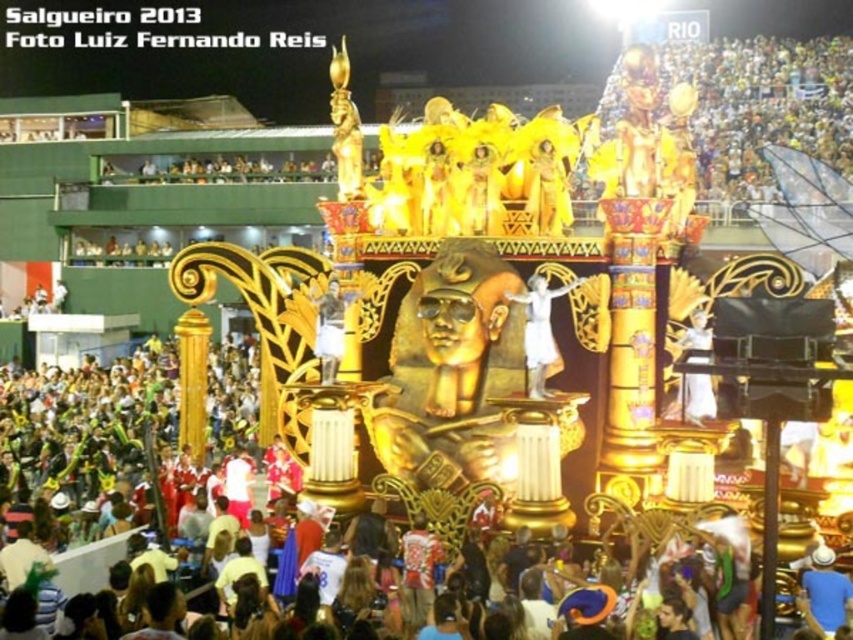
Can you confirm if white satin dress at center is positioned to the left of metallic gold statue at center?

In fact, white satin dress at center is to the right of metallic gold statue at center.

Can you confirm if white satin dress at center is taller than metallic gold statue at center?

No, white satin dress at center is not taller than metallic gold statue at center.

Looking at this image, who is more distant from viewer, (x=552, y=342) or (x=329, y=310)?

Positioned behind is point (x=329, y=310).

This screenshot has height=640, width=853. Identify the location of white satin dress at center. (540, 332).

Does white satin dress at center have a lesser height compared to golden statue at center?

Indeed, white satin dress at center has a lesser height compared to golden statue at center.

Who is more forward, (537, 298) or (703, 342)?

Point (537, 298)

Where is `white satin dress at center`? The width and height of the screenshot is (853, 640). white satin dress at center is located at coordinates (540, 332).

Can you confirm if golden statue at center is positioned to the left of metallic gold statue at center?

In fact, golden statue at center is to the right of metallic gold statue at center.

Is the position of golden statue at center more distant than that of metallic gold statue at center?

No, it is not.

This screenshot has height=640, width=853. I want to click on golden statue at center, so click(x=695, y=397).